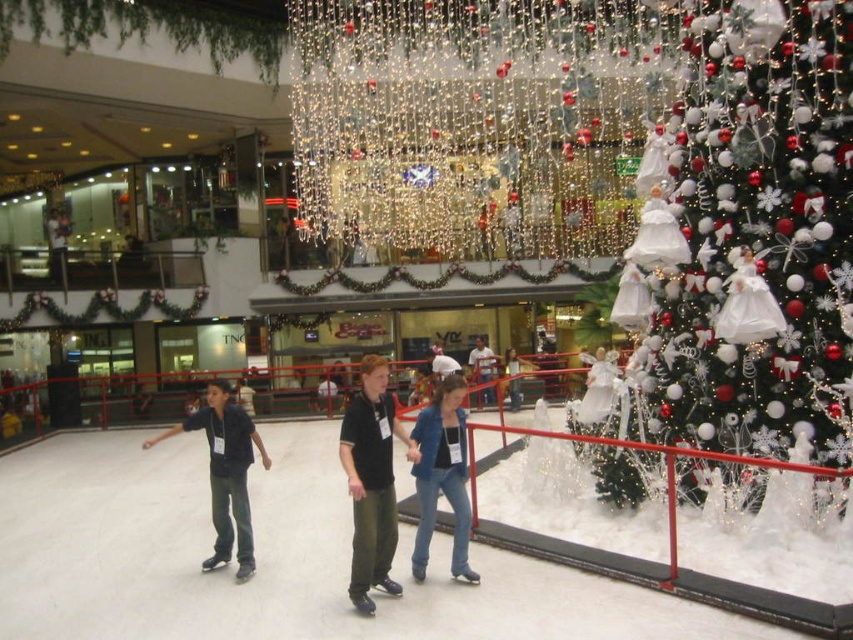
Question: Among these objects, which one is nearest to the camera?

Choices:
 (A) black matte shirt at center
 (B) matte black jacket at center
 (C) white glittering tree at upper right

Answer: (A)

Question: Which point is closer to the camera?

Choices:
 (A) (660, 353)
 (B) (376, 493)

Answer: (B)

Question: Does black matte shirt at center have a greater width compared to blue denim jeans at center?

Choices:
 (A) no
 (B) yes

Answer: (B)

Question: Is dark blue jeans at center closer to camera compared to blue denim jeans at center?

Choices:
 (A) yes
 (B) no

Answer: (A)

Question: Can you confirm if dark blue jeans at center is positioned below matte black jacket at center?

Choices:
 (A) yes
 (B) no

Answer: (A)

Question: Which object is farther from the camera taking this photo?

Choices:
 (A) dark blue jeans at center
 (B) white glittering tree at upper right

Answer: (B)